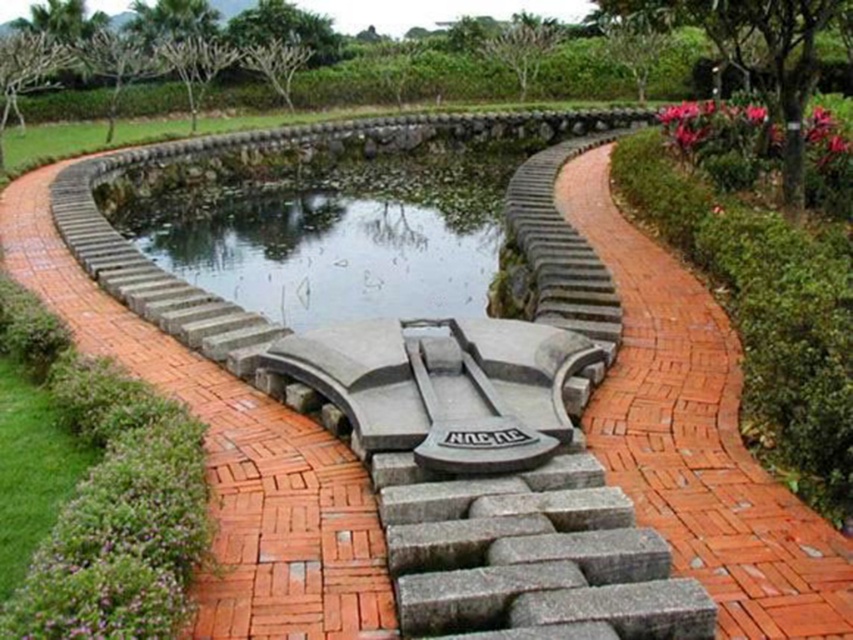
You are standing at the entrance of the garden and want to reach the pond. The red brick pathway at center is your only path. Can you walk straight from the entrance to the pond without deviating from the path?

The red brick pathway at center is positioned at coordinates point (698, 438), so yes, you can walk straight from the entrance to the pond along the red brick pathway at center without deviating.

From the picture: You are a gardener planning to install a new flower bed between the red brick pathway at center and the clear glass pond at center. Which object should you start working on first based on their proximity to you?

You should start working on the red brick pathway at center first since it is closer to you than the clear glass pond at center.

You are standing at the point labeled as point (x=698, y=438) in the garden. Which object from the scene is directly under your feet?

The point (x=698, y=438) is on the red brick pathway at center, so the object directly under your feet is the red brick pathway at center.